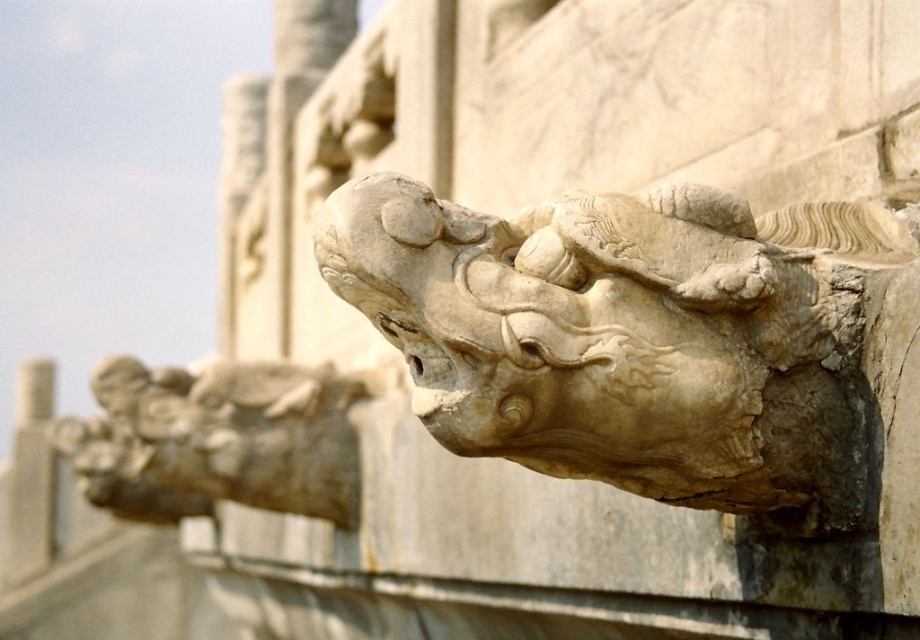
Question: Which point is farther from the camera taking this photo?

Choices:
 (A) (341, 454)
 (B) (447, 401)

Answer: (A)

Question: Is white stone dragon at upper center above white stone dragon at upper left?

Choices:
 (A) no
 (B) yes

Answer: (B)

Question: Which point is farther to the camera?

Choices:
 (A) (317, 426)
 (B) (773, 493)

Answer: (A)

Question: Is white stone dragon at upper center positioned before white stone dragon at upper left?

Choices:
 (A) yes
 (B) no

Answer: (A)

Question: Can you confirm if white stone dragon at upper center is positioned below white stone dragon at upper left?

Choices:
 (A) yes
 (B) no

Answer: (B)